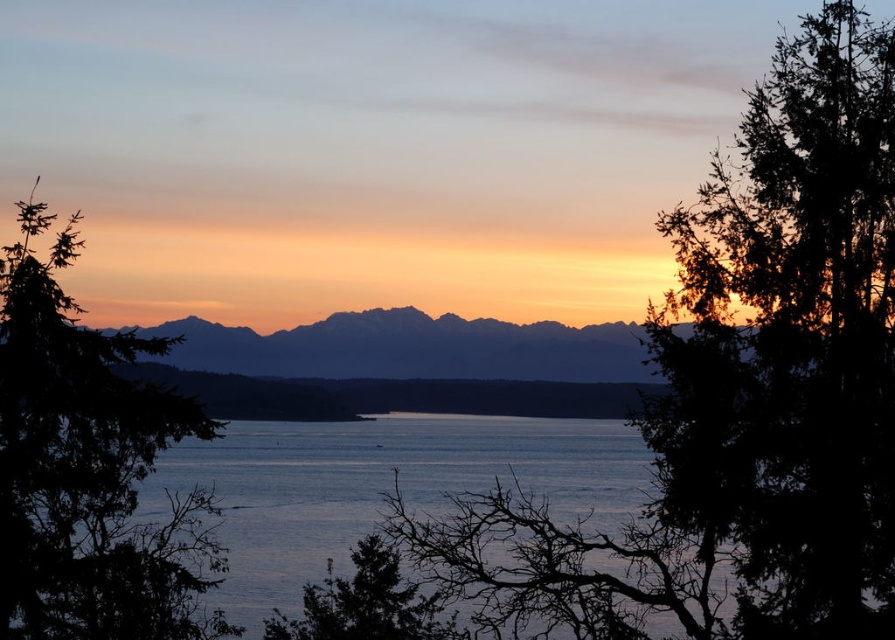
You are standing on the shore of the lake and see the green leafy tree at left and the silhouetted rock formation at center. Which object is higher in the scene?

The green leafy tree at left is located above the silhouetted rock formation at center, so it is higher in the scene.

From the picture: You are standing in the serene sunset scene and want to walk from your current position to the point at coordinates point (489, 337). There is an obstacle at point (365, 499). Will you encounter the obstacle before reaching your destination?

Yes, you will encounter the obstacle at point (365, 499) before reaching point (489, 337) because point (365, 499) is closer to the viewer than point (489, 337).

You are standing at the point closest to the viewer in the sunset scene. Which point, point (590, 598) or point (593, 448), are you standing at?

You are standing at point (590, 598) because it is in front of point (593, 448), making it closer to the viewer.